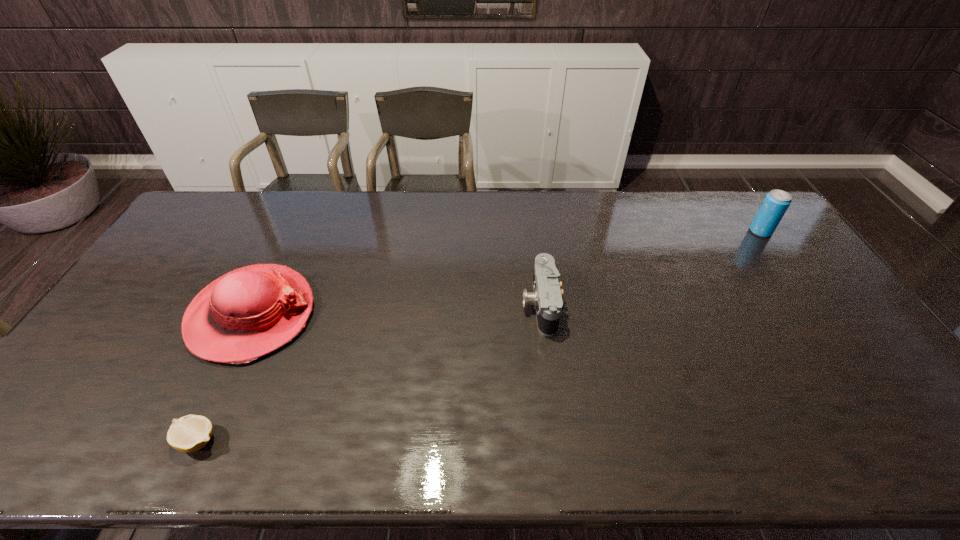
You are a GUI agent. You are given a task and a screenshot of the screen. Output one action in this format:
    pyautogui.click(x=<x>, y=<y>)
    Task: Click on the soda can
    The height and width of the screenshot is (540, 960).
    Given the screenshot: What is the action you would take?
    pyautogui.click(x=776, y=202)

Locate an element on the screen. the farthest object is located at coordinates (776, 202).

At what (x,y) coordinates should I click in order to perform the action: click on hat. Please return your answer as a coordinate pair (x, y). Looking at the image, I should click on coord(247,313).

The width and height of the screenshot is (960, 540). What are the coordinates of `the third tallest object` in the screenshot? It's located at (546, 297).

At what (x,y) coordinates should I click in order to perform the action: click on the third object from left to right. Please return your answer as a coordinate pair (x, y). Looking at the image, I should click on (546, 297).

In order to click on the shortest object in this screenshot , I will do `click(190, 433)`.

Locate an element on the screen. The width and height of the screenshot is (960, 540). lemon is located at coordinates (190, 433).

Identify the location of blank area located 0.060m on the left of the rightmost object. coord(732,232).

What are the coordinates of `vacant area situated 0.070m at the front of the hat with a bow` in the screenshot? It's located at (339, 315).

Where is `free region located 0.400m on the lens of the second shortest object`? The height and width of the screenshot is (540, 960). free region located 0.400m on the lens of the second shortest object is located at coordinates (387, 305).